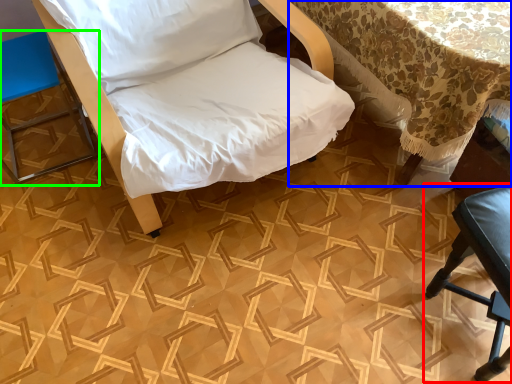
Question: Based on their relative distances, which object is farther from furniture (highlighted by a red box)? Choose from table (highlighted by a blue box) and furniture (highlighted by a green box).

Choices:
 (A) table
 (B) furniture

Answer: (B)